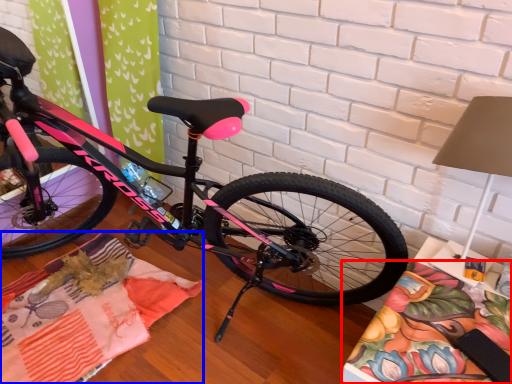
Question: Among these objects, which one is farthest to the camera, blanket (highlighted by a red box) or blanket (highlighted by a blue box)?

Choices:
 (A) blanket
 (B) blanket

Answer: (B)